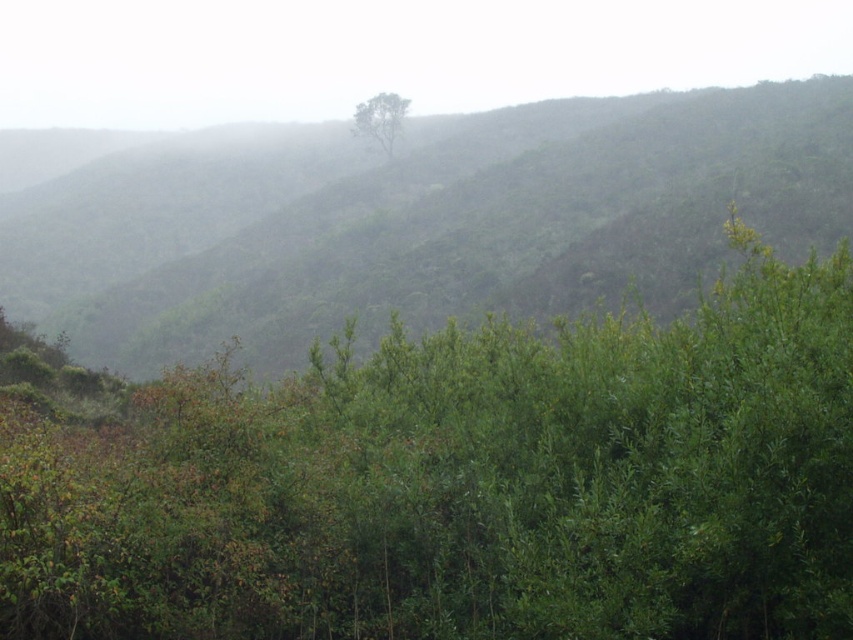
Between green leafy tree at center and green leafy tree at upper center, which one appears on the right side from the viewer's perspective?

Positioned to the right is green leafy tree at center.

Which is behind, point (364, 621) or point (389, 99)?

Positioned behind is point (389, 99).

You are a GUI agent. You are given a task and a screenshot of the screen. Output one action in this format:
    pyautogui.click(x=<x>, y=<y>)
    Task: Click on the green leafy tree at center
    The width and height of the screenshot is (853, 640).
    Given the screenshot: What is the action you would take?
    pyautogui.click(x=465, y=484)

Can you confirm if green leafy tree at center is positioned to the left of green leafy hillside at center?

Incorrect, green leafy tree at center is not on the left side of green leafy hillside at center.

The height and width of the screenshot is (640, 853). Identify the location of green leafy tree at center. (465, 484).

Where is `green leafy tree at center`? green leafy tree at center is located at coordinates click(x=465, y=484).

Which is below, green leafy hillside at center or green leafy tree at upper center?

Positioned lower is green leafy hillside at center.

Who is more forward, (444,150) or (393,104)?

Point (444,150) is in front.

Does point (795, 161) come closer to viewer compared to point (368, 108)?

That is True.

Identify the location of green leafy hillside at center. (445, 221).